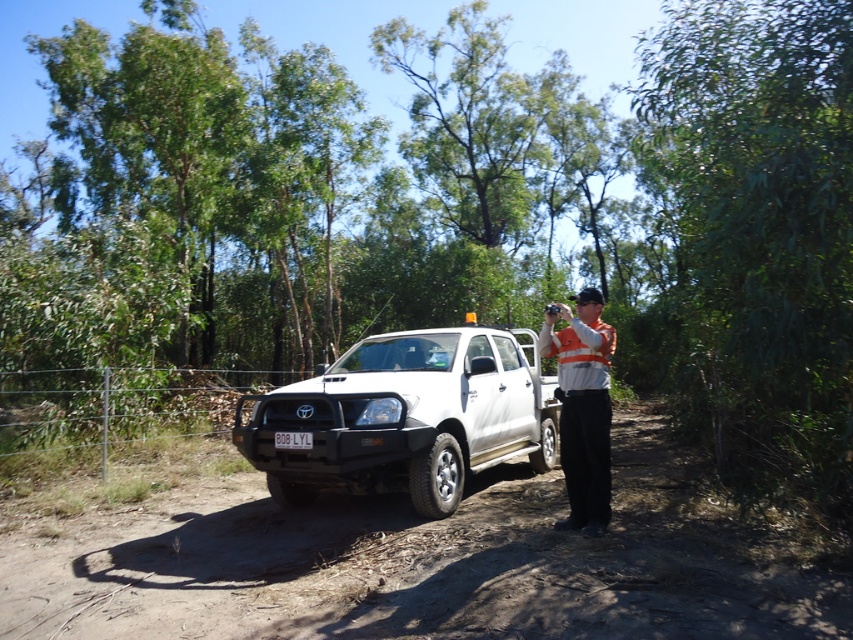
You are a delivery driver who needs to check the license plate of the white matte truck at center. Since you can see the white plastic license plate at center, can you confirm if it is visible from your current position?

The white matte truck at center is in front of the white plastic license plate at center, so the license plate may be blocked from view by the truck itself. You might need to move around to get a clear view.